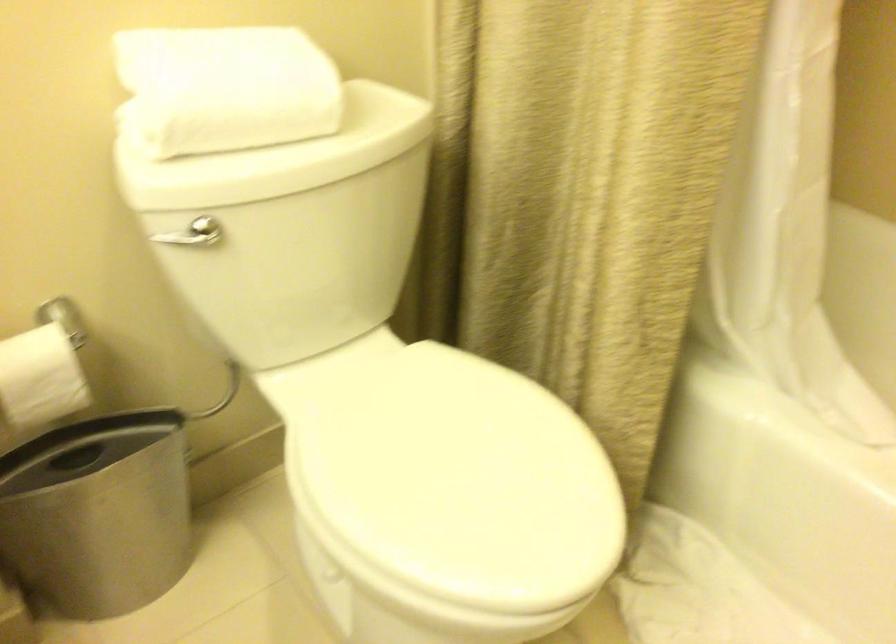
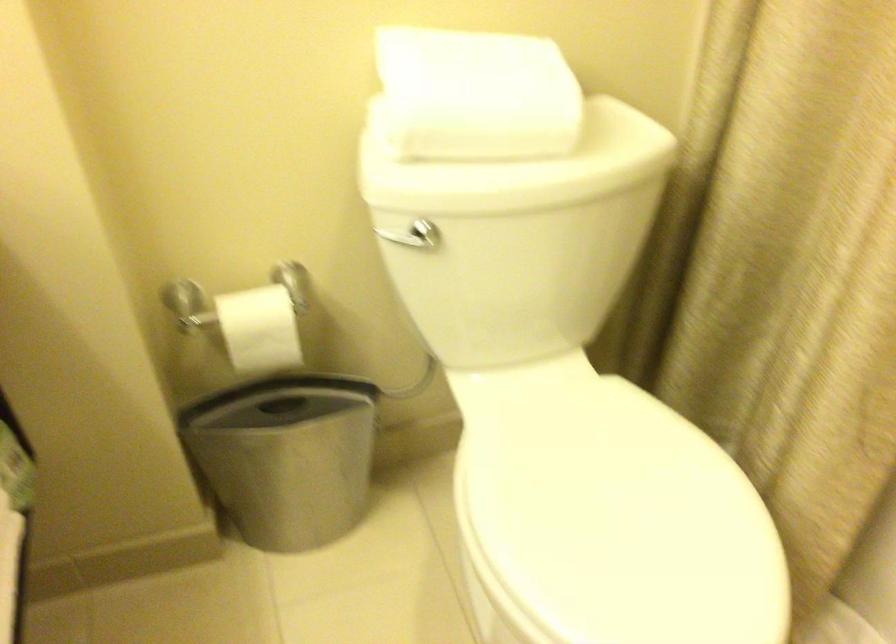
In the second image, find the point that corresponds to [98,504] in the first image.

(286, 456)